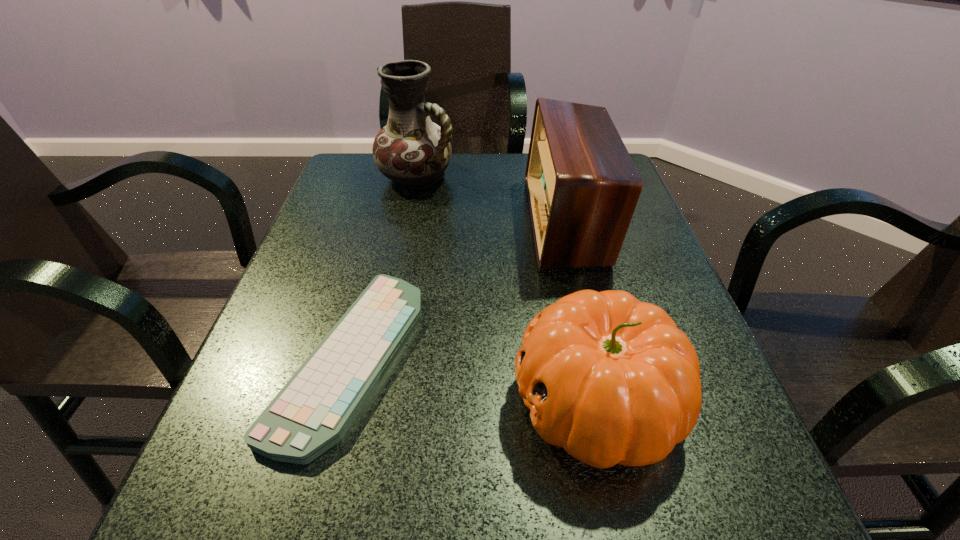
The height and width of the screenshot is (540, 960). In order to click on object present at the far right corner in this screenshot , I will do `click(582, 185)`.

Find the location of a particular element. This screenshot has width=960, height=540. object positioned at the near right corner is located at coordinates (612, 380).

Locate an element on the screen. free space at the far edge of the desktop is located at coordinates coord(496,176).

Identify the location of vacant region at the near edge of the desktop. The image size is (960, 540). (494, 476).

The height and width of the screenshot is (540, 960). In the image, there is a desktop. Find the location of `blank space at the left edge`. blank space at the left edge is located at coordinates 276,305.

This screenshot has width=960, height=540. What are the coordinates of `free space at the right edge` in the screenshot? It's located at (635, 246).

You are a GUI agent. You are given a task and a screenshot of the screen. Output one action in this format:
    pyautogui.click(x=<x>, y=<y>)
    Task: Click on the vacant space at the far left corner
    Image resolution: width=960 pixels, height=540 pixels.
    Given the screenshot: What is the action you would take?
    pyautogui.click(x=367, y=167)

At what (x,y) coordinates should I click in order to perform the action: click on free space between the second shortest object and the tallest object. Please return your answer as a coordinate pair (x, y). Looking at the image, I should click on (507, 289).

This screenshot has height=540, width=960. I want to click on free space between the computer keyboard and the tallest object, so click(384, 267).

This screenshot has width=960, height=540. What are the coordinates of `free area in between the computer keyboard and the third shortest object` in the screenshot? It's located at (458, 289).